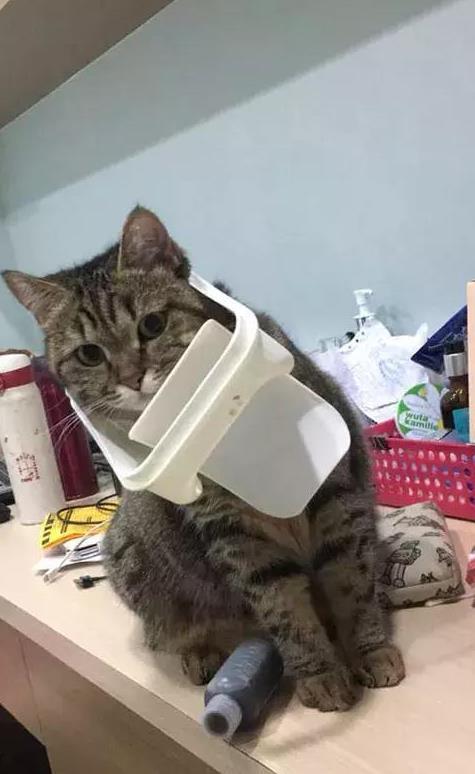
Where is `empty counter`? Image resolution: width=475 pixels, height=774 pixels. empty counter is located at coordinates (379, 758).